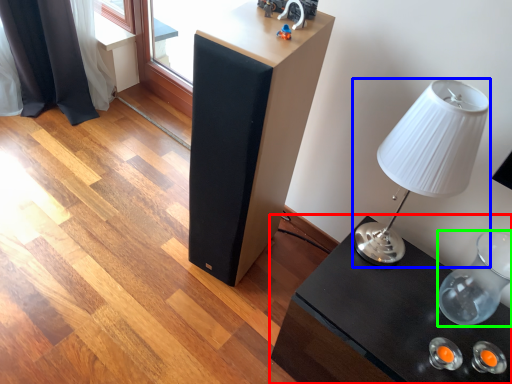
Question: Estimate the real-world distances between objects in this image. Which object is closer to table (highlighted by a red box), lamp (highlighted by a blue box) or glass vase (highlighted by a green box)?

Choices:
 (A) lamp
 (B) glass vase

Answer: (B)